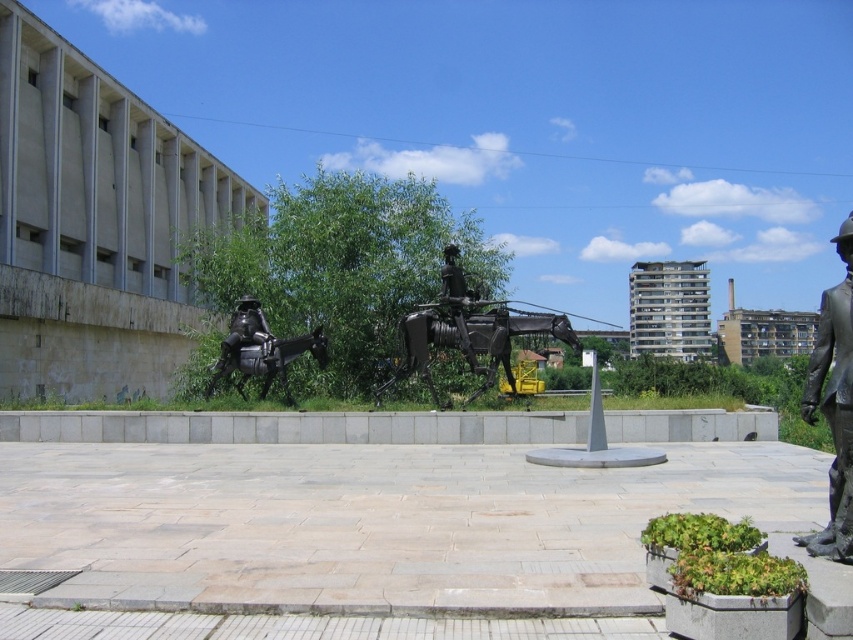
Consider the image. Which of these two, bronze horse and rider at center or shiny black robot at lower left, stands shorter?

bronze horse and rider at center is shorter.

Can you confirm if bronze horse and rider at center is smaller than shiny black robot at lower left?

Indeed, bronze horse and rider at center has a smaller size compared to shiny black robot at lower left.

Does point (393, 374) come in front of point (264, 321)?

Yes, point (393, 374) is in front of point (264, 321).

Find the location of a particular element. The height and width of the screenshot is (640, 853). bronze horse and rider at center is located at coordinates tap(469, 332).

Based on the photo, which is above, shiny black horse at center or shiny black robot at lower left?

shiny black robot at lower left is higher up.

Is point (219, 376) positioned in front of point (227, 337)?

Yes.

The height and width of the screenshot is (640, 853). I want to click on shiny black horse at center, so [270, 362].

Does bronze horse and rider at center have a greater width compared to shiny black horse at center?

Incorrect, bronze horse and rider at center's width does not surpass shiny black horse at center's.

Does bronze horse and rider at center appear over shiny black horse at center?

Indeed, bronze horse and rider at center is positioned over shiny black horse at center.

Is point (468, 340) farther from viewer compared to point (302, 336)?

No, it is in front of (302, 336).

The width and height of the screenshot is (853, 640). I want to click on bronze horse and rider at center, so click(469, 332).